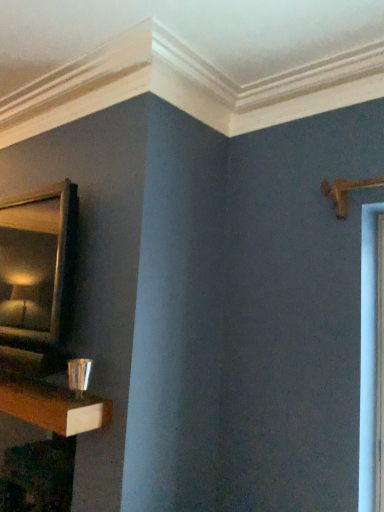
What do you see at coordinates (36, 274) in the screenshot? This screenshot has height=512, width=384. I see `gold-framed mirror at upper left` at bounding box center [36, 274].

Measure the distance between gold-framed mirror at upper left and camera.

gold-framed mirror at upper left and camera are 6.42 feet apart.

Identify the location of wooden table at lower left. (53, 407).

Find the location of a particular element. This screenshot has width=384, height=512. shelf on the right of the wooden table at lower left is located at coordinates (52, 405).

Does wooden table at lower left turn towards shiny metallic cup at lower left?

No.

Is wooden table at lower left surrounding shiny metallic cup at lower left?

No, shiny metallic cup at lower left is located outside of wooden table at lower left.

In terms of size, does wooden table at lower left appear bigger or smaller than gold-framed mirror at upper left?

In the image, wooden table at lower left appears to be larger than gold-framed mirror at upper left.

In the image, is wooden table at lower left on the left side or the right side of gold-framed mirror at upper left?

Based on their positions, wooden table at lower left is located to the right of gold-framed mirror at upper left.

From a real-world perspective, which is physically below, wooden table at lower left or gold-framed mirror at upper left?

In real-world perspective, wooden table at lower left is lower.

Is point (17, 384) closer or farther from the camera than point (34, 424)?

Point (17, 384) appears to be farther away from the viewer than point (34, 424).

Can you tell me how much shiny metallic cup at lower left and wooden table at lower left differ in facing direction?

The angular difference between shiny metallic cup at lower left and wooden table at lower left is 0.102 degrees.

Which of these two, shiny metallic cup at lower left or wooden table at lower left, is bigger?

With larger size is wooden table at lower left.

Considering the relative sizes of shiny metallic cup at lower left and wooden table at lower left in the image provided, is shiny metallic cup at lower left taller than wooden table at lower left?

In fact, shiny metallic cup at lower left may be shorter than wooden table at lower left.

Would you say gold-framed mirror at upper left is outside wooden table at lower left?

That's correct, gold-framed mirror at upper left is outside of wooden table at lower left.

Which object is thinner, gold-framed mirror at upper left or wooden table at lower left?

Thinner between the two is gold-framed mirror at upper left.

Considering the positions of point (34, 215) and point (38, 412), is point (34, 215) closer or farther from the camera than point (38, 412)?

Point (34, 215) appears to be farther away from the viewer than point (38, 412).

From the image's perspective, would you say gold-framed mirror at upper left is positioned over wooden table at lower left?

Correct, gold-framed mirror at upper left appears higher than wooden table at lower left in the image.

Between shiny metallic cup at lower left and gold-framed mirror at upper left, which one has less height?

With less height is shiny metallic cup at lower left.

How many degrees apart are the facing directions of shiny metallic cup at lower left and gold-framed mirror at upper left?

There is a 0.158-degree angle between the facing directions of shiny metallic cup at lower left and gold-framed mirror at upper left.

Is shiny metallic cup at lower left inside the boundaries of gold-framed mirror at upper left, or outside?

shiny metallic cup at lower left lies outside gold-framed mirror at upper left.

Is shiny metallic cup at lower left oriented towards gold-framed mirror at upper left?

No, shiny metallic cup at lower left is not oriented towards gold-framed mirror at upper left.

Is gold-framed mirror at upper left shorter than shiny metallic cup at lower left?

In fact, gold-framed mirror at upper left may be taller than shiny metallic cup at lower left.

Is point (1, 256) less distant than point (58, 425)?

That is False.

In terms of width, does gold-framed mirror at upper left look wider or thinner when compared to shiny metallic cup at lower left?

gold-framed mirror at upper left is thinner than shiny metallic cup at lower left.

Where is `shelf on the right of the wooden table at lower left`? This screenshot has height=512, width=384. shelf on the right of the wooden table at lower left is located at coordinates (52, 405).

You are a GUI agent. You are given a task and a screenshot of the screen. Output one action in this format:
    pyautogui.click(x=<x>, y=<y>)
    Task: Click on the mirror above the wooden table at lower left (from a real-world perspective)
    This screenshot has height=512, width=384.
    Given the screenshot: What is the action you would take?
    pyautogui.click(x=36, y=274)

Which object lies nearer to the anchor point gold-framed mirror at upper left, shiny metallic cup at lower left or wooden table at lower left?

shiny metallic cup at lower left lies closer to gold-framed mirror at upper left than the other object.

Estimate the real-world distances between objects in this image. Which object is further from shiny metallic cup at lower left, gold-framed mirror at upper left or wooden table at lower left?

Based on the image, gold-framed mirror at upper left appears to be further to shiny metallic cup at lower left.

Estimate the real-world distances between objects in this image. Which object is further from gold-framed mirror at upper left, wooden table at lower left or shiny metallic cup at lower left?

wooden table at lower left is positioned further to the anchor gold-framed mirror at upper left.

In the scene shown: Based on their spatial positions, is gold-framed mirror at upper left or shiny metallic cup at lower left further from wooden table at lower left?

Based on the image, gold-framed mirror at upper left appears to be further to wooden table at lower left.

Looking at the image, which one is located closer to shiny metallic cup at lower left, wooden table at lower left or gold-framed mirror at upper left?

The object closer to shiny metallic cup at lower left is wooden table at lower left.

Which object lies further to the anchor point wooden table at lower left, shiny metallic cup at lower left or gold-framed mirror at upper left?

gold-framed mirror at upper left is further to wooden table at lower left.

At what (x,y) coordinates should I click in order to perform the action: click on shelf between gold-framed mirror at upper left and wooden table at lower left in the vertical direction. Please return your answer as a coordinate pair (x, y). The height and width of the screenshot is (512, 384). Looking at the image, I should click on [52, 405].